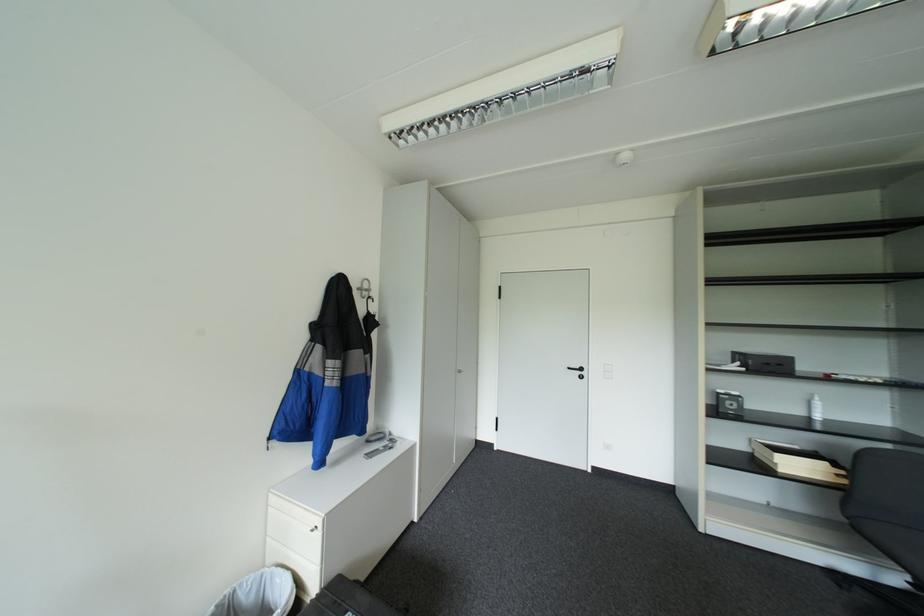
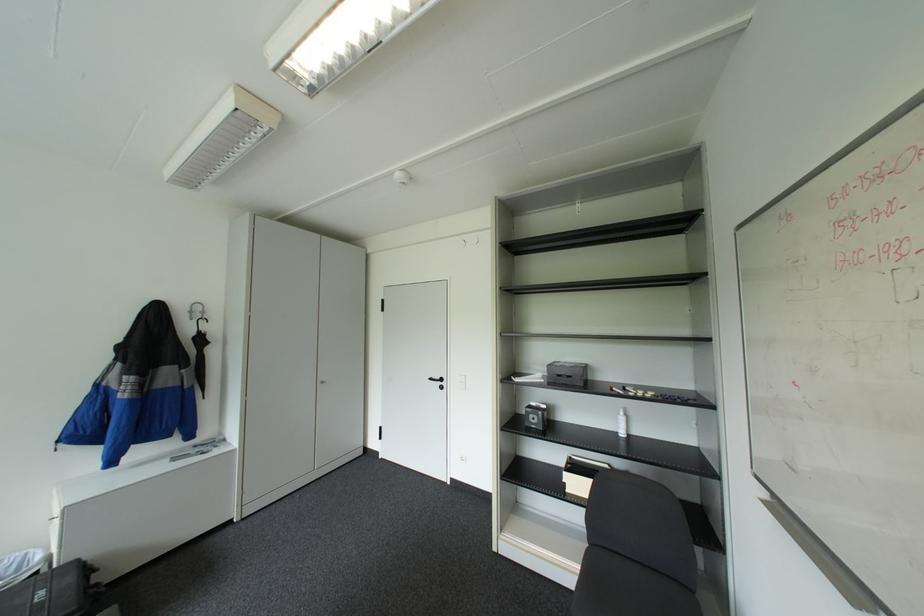
Find the pixel in the second image that matches (x=578, y=367) in the first image.

(439, 378)